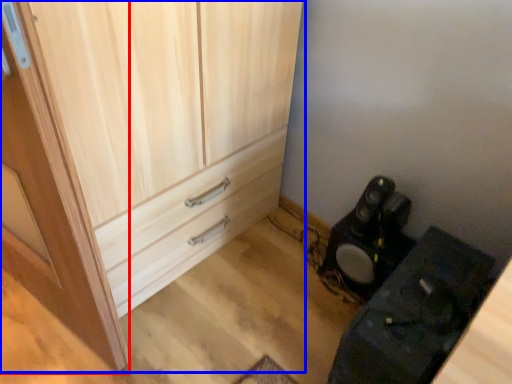
Question: Which point is closer to the camera, door (highlighted by a red box) or cupboard (highlighted by a blue box)?

Choices:
 (A) door
 (B) cupboard

Answer: (A)